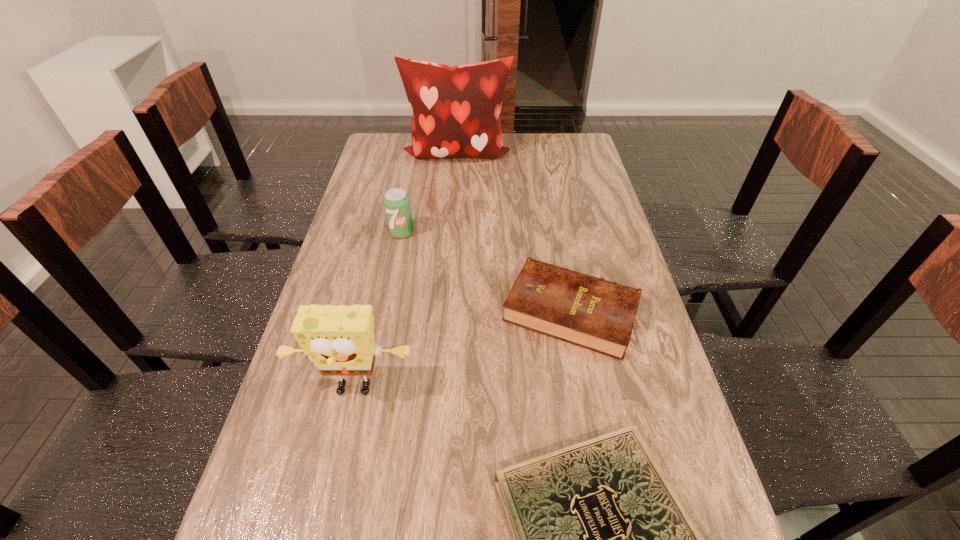
At what (x,y) coordinates should I click in order to perform the action: click on cushion. Please return your answer as a coordinate pair (x, y). The height and width of the screenshot is (540, 960). Looking at the image, I should click on (456, 109).

This screenshot has height=540, width=960. I want to click on the farthest object, so click(x=456, y=109).

Identify the location of sponge. The image size is (960, 540). (339, 340).

The width and height of the screenshot is (960, 540). What are the coordinates of `the second nearest object` in the screenshot? It's located at click(x=339, y=340).

Locate an element on the screen. soda is located at coordinates (396, 202).

Identify the location of the second farthest object. This screenshot has height=540, width=960. click(396, 202).

Find the location of a particular element. Image resolution: width=960 pixels, height=540 pixels. the taller hardback book is located at coordinates (590, 312).

At what (x,y) coordinates should I click in order to perform the action: click on the third nearest object. Please return your answer as a coordinate pair (x, y). The image size is (960, 540). Looking at the image, I should click on (590, 312).

Identify the location of vacant space situated 0.080m on the front-facing side of the cushion. (454, 181).

Find the location of `free region located on the front-facing side of the second tallest object`. free region located on the front-facing side of the second tallest object is located at coordinates point(322,533).